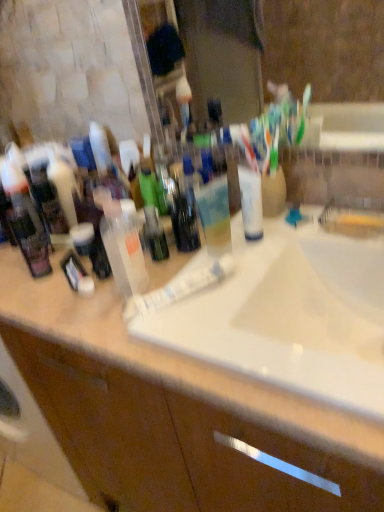
The width and height of the screenshot is (384, 512). I want to click on translucent plastic bottle at center, so click(x=185, y=211).

Where is `brown wood bathroom cabinet at center`? brown wood bathroom cabinet at center is located at coordinates (173, 442).

Find the location of a particular element. matte black lotion at center, arranged as the 1th toiletry when viewed from the left is located at coordinates point(47,199).

Describe the element at coordinates (47, 199) in the screenshot. The image size is (384, 512). I see `matte black lotion at center, arranged as the 5th toiletry when viewed from the right` at that location.

Locate an element on the screen. The image size is (384, 512). translucent plastic bottle at center is located at coordinates (185, 211).

Is translucent plastic bottle at center turned away from translucent plastic spray bottle at center?

translucent plastic bottle at center does not have its back to translucent plastic spray bottle at center.

Between translucent plastic bottle at center and translucent plastic spray bottle at center, which one has larger size?

translucent plastic spray bottle at center is bigger.

Is translucent plastic bottle at center at the right side of translucent plastic spray bottle at center?

Indeed, translucent plastic bottle at center is positioned on the right side of translucent plastic spray bottle at center.

Is translucent plastic bottle at center wider than translucent plastic spray bottle at center?

Incorrect, the width of translucent plastic bottle at center does not surpass that of translucent plastic spray bottle at center.

Is translucent plastic bottle at center positioned before white plastic tube at center?

No, it is behind white plastic tube at center.

Which point is more distant from viewer, (x=183, y=238) or (x=258, y=174)?

Point (x=183, y=238)

Considering the relative positions of translucent plastic bottle at center and white plastic tube at center in the image provided, is translucent plastic bottle at center to the left or to the right of white plastic tube at center?

Clearly, translucent plastic bottle at center is on the left of white plastic tube at center in the image.

From a real-world perspective, is translucent plastic bottle at center beneath white plastic tube at center?

Indeed, from a real-world perspective, translucent plastic bottle at center is positioned beneath white plastic tube at center.

From the image's perspective, would you say translucent plastic bottle at center is shown under brown wood bathroom cabinet at center?

No, from the image's perspective, translucent plastic bottle at center is not below brown wood bathroom cabinet at center.

Is translucent plastic bottle at center to the left or to the right of brown wood bathroom cabinet at center in the image?

In the image, translucent plastic bottle at center appears on the right side of brown wood bathroom cabinet at center.

Between translucent plastic bottle at center and brown wood bathroom cabinet at center, which one has larger width?

brown wood bathroom cabinet at center.

From a real-world perspective, is translucent plastic bottle at center physically above brown wood bathroom cabinet at center?

Yes.

I want to click on bottle above the translucent plastic tube at left, which ranks as the 2th toiletry in left-to-right order (from the image's perspective), so [185, 211].

Between translucent plastic bottle at center and translucent plastic tube at left, the fourth toiletry positioned from the right, which one appears on the right side from the viewer's perspective?

From the viewer's perspective, translucent plastic bottle at center appears more on the right side.

Is translucent plastic bottle at center next to translucent plastic tube at left, the fourth toiletry positioned from the right?

No, translucent plastic bottle at center is not next to translucent plastic tube at left, the fourth toiletry positioned from the right.

From the image's perspective, is translucent plastic bottle at center on top of translucent plastic tube at left, the fourth toiletry positioned from the right?

Yes.

Is white glossy tube at center inside translucent plastic spray bottle at center?

Definitely not — white glossy tube at center is not inside translucent plastic spray bottle at center.

Which of these two, translucent plastic spray bottle at center or white glossy tube at center, stands taller?

translucent plastic spray bottle at center is taller.

Considering the sizes of objects white glossy sink at center and white glossy tube at center in the image provided, who is smaller, white glossy sink at center or white glossy tube at center?

With smaller size is white glossy tube at center.

Consider the image. From a real-world perspective, does white glossy sink at center stand above white glossy tube at center?

No, from a real-world perspective, white glossy sink at center is not over white glossy tube at center

This screenshot has height=512, width=384. What are the coordinates of `toothpaste above the white glossy sink at center (from the image's perspective)` in the screenshot? It's located at (180, 288).

In the image, is white plastic tube at center positioned in front of or behind translucent plastic spray bottle at center?

white plastic tube at center is behind translucent plastic spray bottle at center.

From the picture: Considering the sizes of white plastic tube at center and translucent plastic spray bottle at center in the image, is white plastic tube at center bigger or smaller than translucent plastic spray bottle at center?

Clearly, white plastic tube at center is smaller in size than translucent plastic spray bottle at center.

Is white plastic tube at center positioned with its back to translucent plastic spray bottle at center?

No, translucent plastic spray bottle at center is not at the back of white plastic tube at center.

At what (x,y) coordinates should I click in order to perform the action: click on cleaning product above the translucent plastic bottle at center (from a real-world perspective). Please return your answer as a coordinate pair (x, y). The width and height of the screenshot is (384, 512). Looking at the image, I should click on (123, 250).

Where is `mouthwash that appears on the right of translucent plastic bottle at center`? This screenshot has width=384, height=512. mouthwash that appears on the right of translucent plastic bottle at center is located at coordinates 251,203.

From the picture: Based on their spatial positions, is translucent plastic tube at left, the fourth toiletry positioned from the right, or matte black lotion at center, arranged as the 5th toiletry when viewed from the right, further from translucent plastic spray bottle at center?

The object further to translucent plastic spray bottle at center is matte black lotion at center, arranged as the 5th toiletry when viewed from the right.

Considering their positions, is white glossy sink at center positioned closer to brown wood bathroom cabinet at center than matte black lotion at center, arranged as the 5th toiletry when viewed from the right?

white glossy sink at center lies closer to brown wood bathroom cabinet at center than the other object.

Looking at the image, which one is located further to white matte jar at center-left, the second toiletry viewed from the right, black matte toothbrush at left, the third toiletry when ordered from right to left, or white glossy tube at center?

The object further to white matte jar at center-left, the second toiletry viewed from the right, is white glossy tube at center.

Based on their spatial positions, is translucent plastic bottle at center, the first toiletry from the right, or black matte toothbrush at left, marked as the third toiletry in a left-to-right arrangement, closer to matte black lotion at center, arranged as the 1th toiletry when viewed from the left?

The object closer to matte black lotion at center, arranged as the 1th toiletry when viewed from the left, is black matte toothbrush at left, marked as the third toiletry in a left-to-right arrangement.

From the image, which object appears to be nearer to white glossy sink at center, translucent plastic bottle at center or translucent plastic spray bottle at center?

translucent plastic bottle at center is positioned closer to the anchor white glossy sink at center.

When comparing their distances from translucent plastic tube at left, which ranks as the 2th toiletry in left-to-right order, does translucent plastic bottle at center, the first toiletry from the right, or white matte jar at center-left, positioned as the fourth toiletry in left-to-right order, seem closer?

white matte jar at center-left, positioned as the fourth toiletry in left-to-right order, is positioned closer to the anchor translucent plastic tube at left, which ranks as the 2th toiletry in left-to-right order.

Estimate the real-world distances between objects in this image. Which object is closer to brown wood bathroom cabinet at center, translucent plastic spray bottle at center or white glossy tube at center?

Based on the image, white glossy tube at center appears to be nearer to brown wood bathroom cabinet at center.

Based on the photo, estimate the real-world distances between objects in this image. Which object is closer to brown wood bathroom cabinet at center, translucent plastic bottle at center or white glossy sink at center?

white glossy sink at center lies closer to brown wood bathroom cabinet at center than the other object.

Where is `sink between brown wood bathroom cabinet at center and translucent plastic bottle at center in the front-back direction`? sink between brown wood bathroom cabinet at center and translucent plastic bottle at center in the front-back direction is located at coordinates (278, 325).

The width and height of the screenshot is (384, 512). Identify the location of toothpaste between white glossy sink at center and translucent plastic bottle at center, the first toiletry from the right, along the z-axis. (180, 288).

Identify the location of toothpaste between brown wood bathroom cabinet at center and white matte jar at center-left, positioned as the fourth toiletry in left-to-right order, along the z-axis. The height and width of the screenshot is (512, 384). (180, 288).

Image resolution: width=384 pixels, height=512 pixels. Identify the location of cleaning product between matte black lotion at center, arranged as the 1th toiletry when viewed from the left, and translucent plastic bottle at center, in the horizontal direction. pyautogui.click(x=123, y=250).